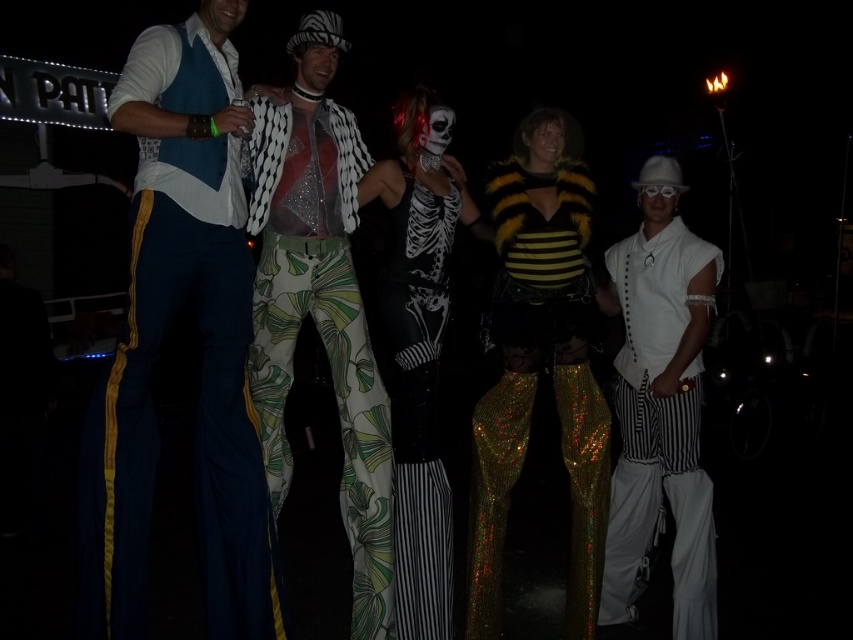
You are at a costume party and notice two items in the scene. The first is the matte blue pants at left, and the second is the matte black mask at center. From your perspective, which item is positioned farther to the left?

The matte blue pants at left is positioned farther to the left than the matte black mask at center.

You are standing at the center of the image. Which object from the list is positioned to your left side? The objects are matte blue pants at left and another object not mentioned here.

The matte blue pants at left is located at point (x=160, y=348), which places it to your left side.

You are standing at the point labeled point (128, 465). You want to move to the entrance of the venue, which is directly behind you. What direction should you turn to face the entrance?

Since the entrance is directly behind you, you should turn around 180 degrees to face it.